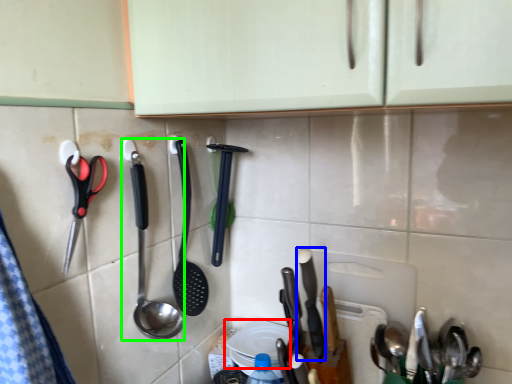
Question: Estimate the real-world distances between objects in this image. Which object is farther from plate (highlighted by a red box), silverware (highlighted by a blue box) or spoon (highlighted by a green box)?

Choices:
 (A) silverware
 (B) spoon

Answer: (B)